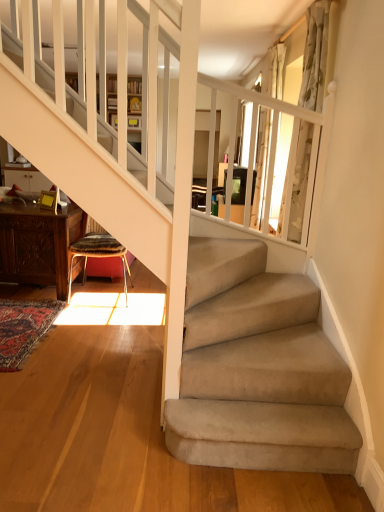
Question: Is white floral fabric curtain at upper right, the first curtain when ordered from front to back, positioned before carved wood table at lower left?

Choices:
 (A) yes
 (B) no

Answer: (A)

Question: Is white floral fabric curtain at upper right, the first curtain when ordered from front to back, further to the viewer compared to carved wood table at lower left?

Choices:
 (A) yes
 (B) no

Answer: (B)

Question: Is white floral fabric curtain at upper right, the first curtain when ordered from front to back, not near carved wood table at lower left?

Choices:
 (A) yes
 (B) no

Answer: (A)

Question: Would you say carved wood table at lower left is part of white floral fabric curtain at upper right, which ranks as the 2th curtain in back-to-front order,'s contents?

Choices:
 (A) yes
 (B) no

Answer: (B)

Question: Is white floral fabric curtain at upper right, which ranks as the 2th curtain in back-to-front order, to the right of carved wood table at lower left from the viewer's perspective?

Choices:
 (A) yes
 (B) no

Answer: (A)

Question: From the image's perspective, is white floral fabric curtain at upper right, the first curtain when ordered from front to back, located beneath carved wood table at lower left?

Choices:
 (A) no
 (B) yes

Answer: (A)

Question: Is white sheer curtain at upper right, which is the first curtain in back-to-front order, at the right side of carved wood table at lower left?

Choices:
 (A) yes
 (B) no

Answer: (A)

Question: Does white sheer curtain at upper right, the 2th curtain from the front, appear on the left side of carved wood table at lower left?

Choices:
 (A) yes
 (B) no

Answer: (B)

Question: Considering the relative sizes of white sheer curtain at upper right, which is the first curtain in back-to-front order, and carved wood table at lower left in the image provided, is white sheer curtain at upper right, which is the first curtain in back-to-front order, smaller than carved wood table at lower left?

Choices:
 (A) yes
 (B) no

Answer: (A)

Question: Is white sheer curtain at upper right, which is the first curtain in back-to-front order, in front of carved wood table at lower left?

Choices:
 (A) yes
 (B) no

Answer: (B)

Question: Is white sheer curtain at upper right, which is the first curtain in back-to-front order, further to camera compared to carved wood table at lower left?

Choices:
 (A) no
 (B) yes

Answer: (B)

Question: Is white sheer curtain at upper right, which is the first curtain in back-to-front order, wider than carved wood table at lower left?

Choices:
 (A) no
 (B) yes

Answer: (A)

Question: Is white floral fabric curtain at upper right, which ranks as the 2th curtain in back-to-front order, at the right side of patterned fabric stool at lower left?

Choices:
 (A) no
 (B) yes

Answer: (B)